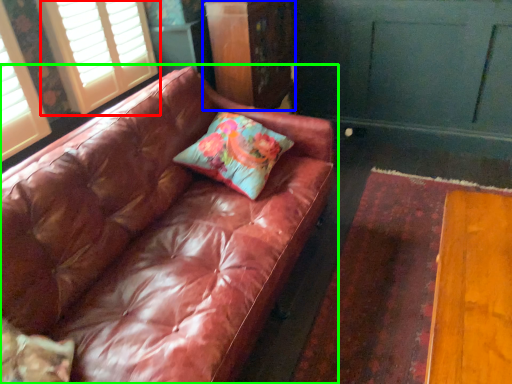
Question: Which object is positioned closest to window (highlighted by a red box)? Select from dresser (highlighted by a blue box) and studio couch (highlighted by a green box).

Choices:
 (A) dresser
 (B) studio couch

Answer: (A)